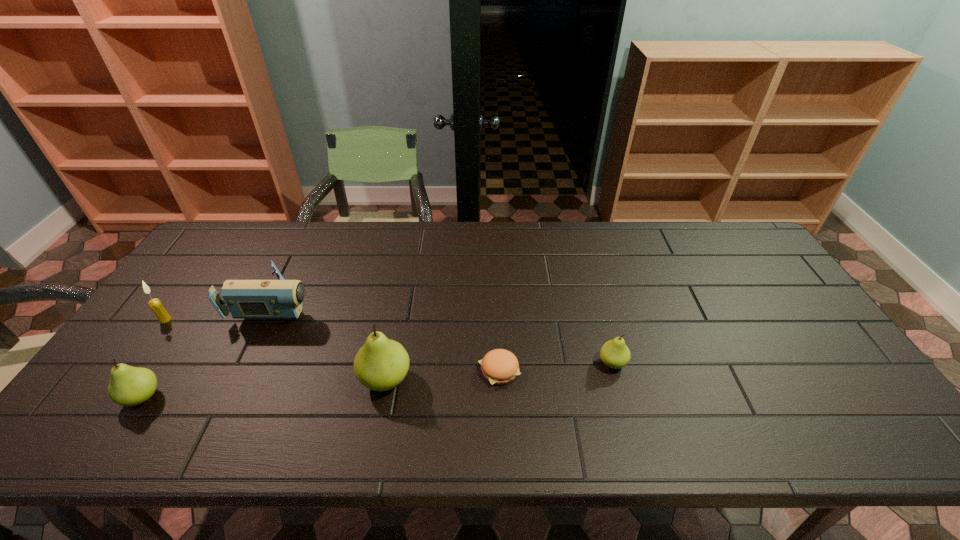
Locate an element on the screen. This screenshot has height=540, width=960. the fifth object from right to left is located at coordinates (129, 386).

You are a GUI agent. You are given a task and a screenshot of the screen. Output one action in this format:
    pyautogui.click(x=<x>, y=<y>)
    Task: Click on the leftmost pear
    
    Given the screenshot: What is the action you would take?
    pyautogui.click(x=129, y=386)

Locate an element on the screen. The image size is (960, 540). the fourth object from left to right is located at coordinates (381, 364).

Locate an element on the screen. The width and height of the screenshot is (960, 540). the tallest object is located at coordinates (381, 364).

The height and width of the screenshot is (540, 960). Identify the location of the rightmost pear. (615, 354).

Identify the location of the rightmost object. Image resolution: width=960 pixels, height=540 pixels. (615, 354).

The image size is (960, 540). What are the coordinates of `candle` in the screenshot? It's located at (162, 315).

Find the location of `patty`. patty is located at coordinates (499, 366).

I want to click on the shortest object, so click(x=499, y=366).

Locate an element on the screen. The height and width of the screenshot is (540, 960). camcorder is located at coordinates (245, 299).